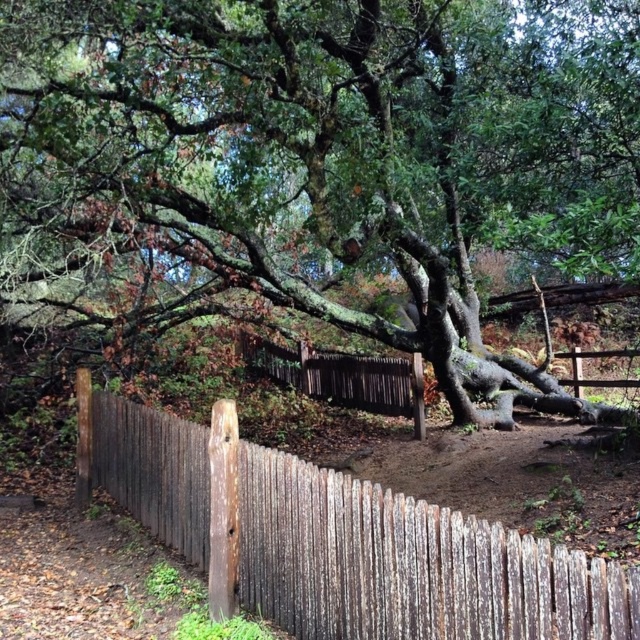
You are a painter standing at the edge of the scene, wanting to paint the green mossy tree at center and the weathered wood fence at center. Which object should you focus on first if you want to paint the taller one?

The weathered wood fence at center is taller than the green mossy tree at center, so you should focus on painting the weathered wood fence at center first.

You are standing at the center of the image and want to walk towards the green mossy tree at center. In which direction should you move?

The green mossy tree at center is already at the center of the image, so you are already facing it directly. There is no need to move in any direction.

You are a painter standing in front of the green mossy tree at center and the weathered wood fence at center. You want to paint the scene as viewed from your current position. Which object should you paint first to maintain the correct spatial relationship?

You should paint the green mossy tree at center first because it is positioned over the weathered wood fence at center, meaning it is closer to you and should be painted before the fence to maintain the correct spatial relationship.